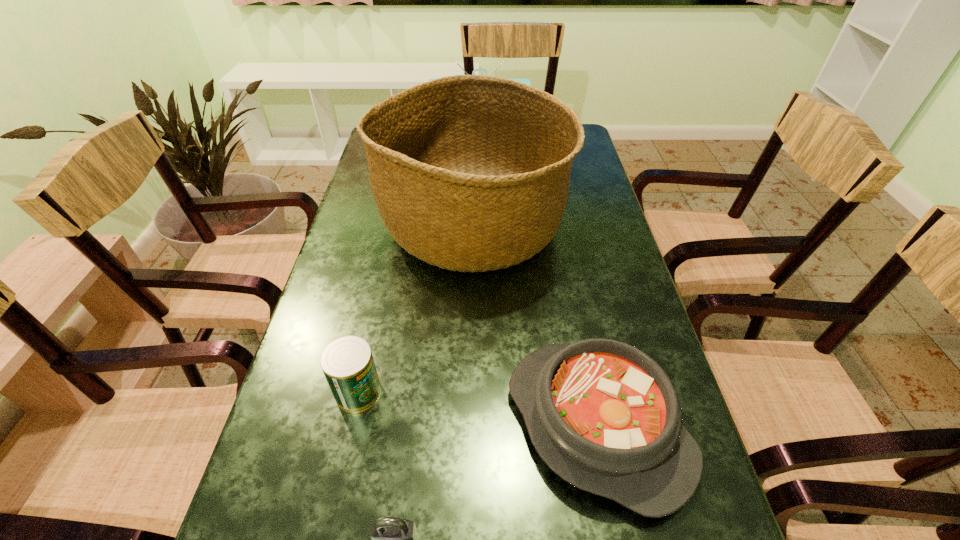
Where is `basket that is at the left edge`? Image resolution: width=960 pixels, height=540 pixels. basket that is at the left edge is located at coordinates (470, 173).

You are a GUI agent. You are given a task and a screenshot of the screen. Output one action in this format:
    pyautogui.click(x=<x>, y=<y>)
    Task: Click on the can that is at the left edge
    
    Given the screenshot: What is the action you would take?
    pyautogui.click(x=347, y=362)

Where is `basket at the right edge`? Image resolution: width=960 pixels, height=540 pixels. basket at the right edge is located at coordinates (470, 173).

Find the location of a particular element. Image resolution: width=960 pixels, height=540 pixels. casserole that is at the right edge is located at coordinates (604, 416).

At what (x,y) coordinates should I click in order to perform the action: click on vacant position at the left edge of the desktop. Please return your answer as a coordinate pair (x, y). Looking at the image, I should click on (386, 237).

I want to click on vacant space at the right edge of the desktop, so click(577, 181).

This screenshot has width=960, height=540. In order to click on vacant point located between the basket and the casserole in this screenshot , I will do `click(535, 326)`.

Identify the location of vacant space that is in between the fourth shortest object and the can. (419, 267).

Locate an element on the screen. This screenshot has width=960, height=540. free spot between the can and the casserole is located at coordinates (478, 409).

Find the location of `object that is the fourth closest to the casserole`. object that is the fourth closest to the casserole is located at coordinates (527, 81).